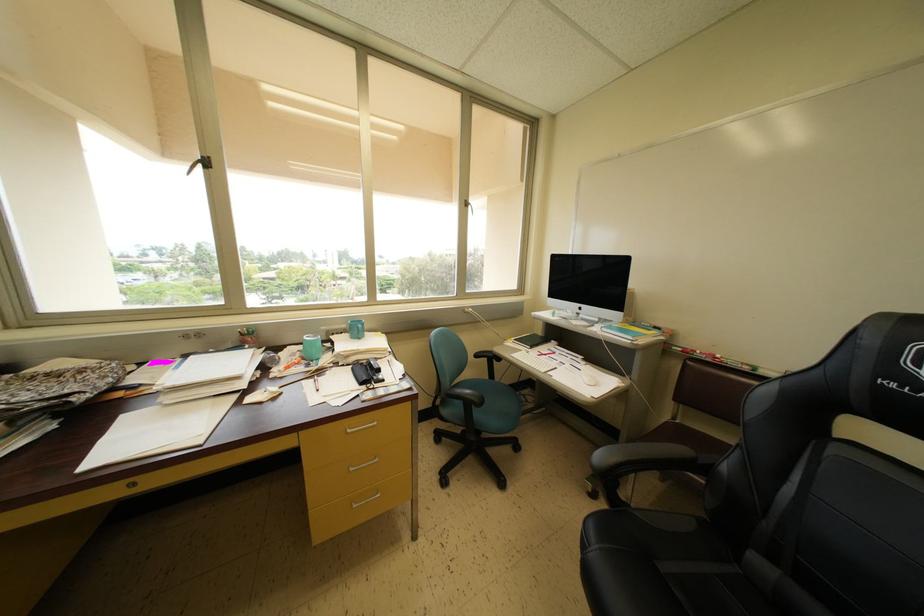
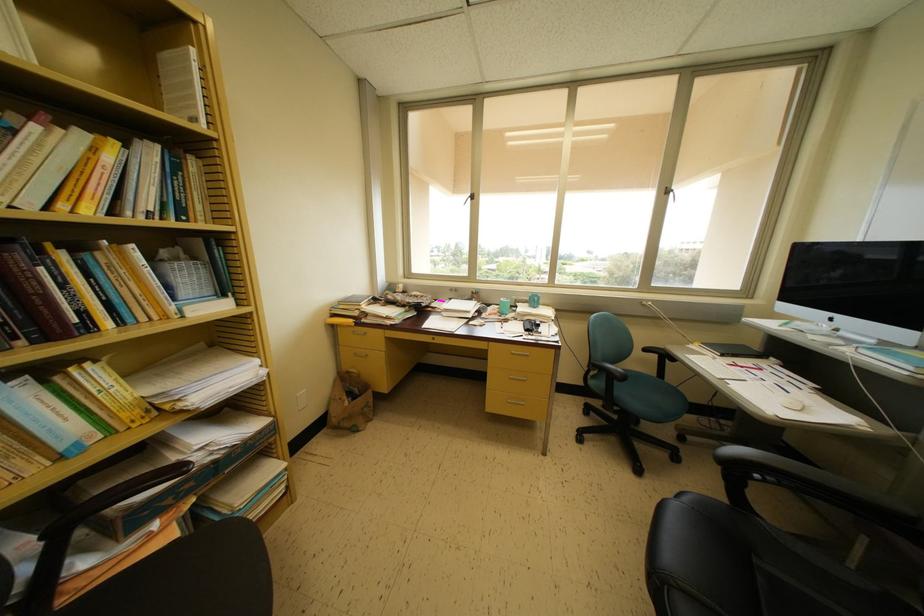
Locate, in the second image, the point that corresponds to (x=188, y=361) in the first image.

(455, 304)